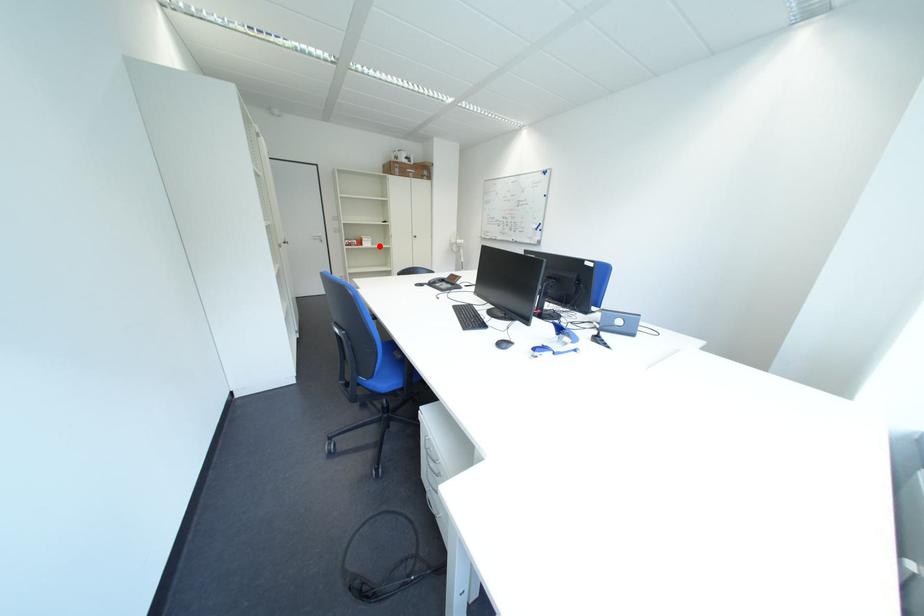
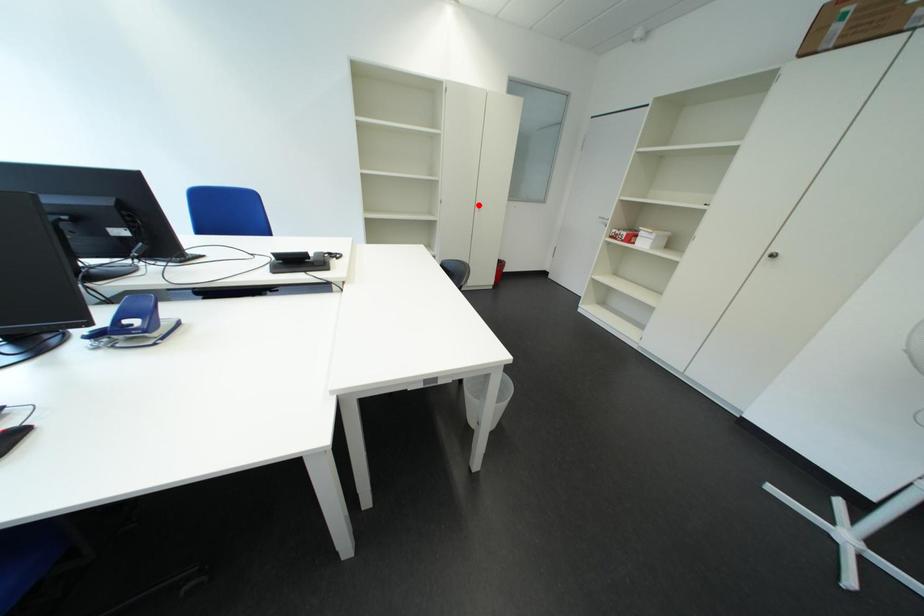
I am providing you with two images of the same scene from different viewpoints. A red point is marked on the first image and another point is marked on the second image. Does the point marked in image1 correspond to the same location as the one in image2?

No